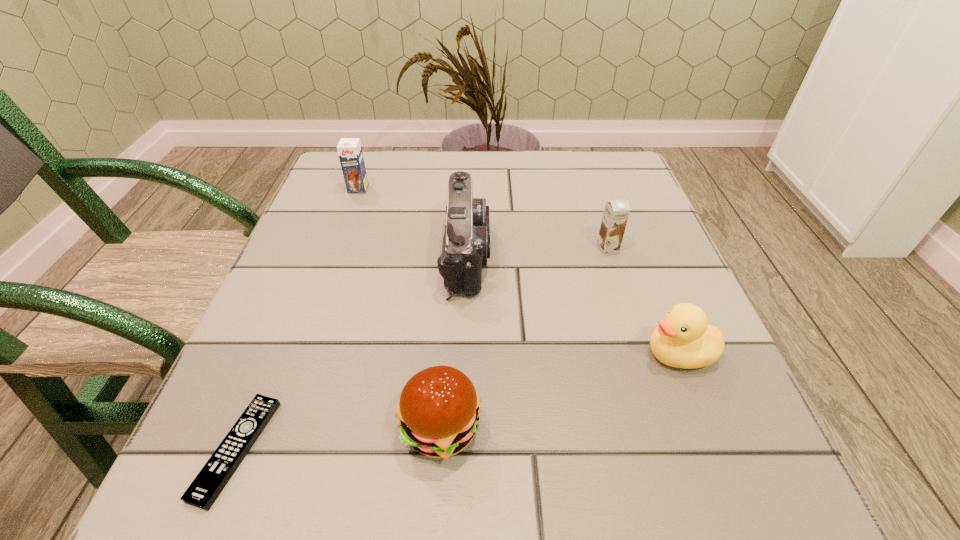
This screenshot has height=540, width=960. What are the coordinates of `the third closest object to the hamburger` in the screenshot? It's located at (683, 339).

Find the location of a particular element. object that ranks as the closest to the camcorder is located at coordinates (439, 410).

You are a GUI agent. You are given a task and a screenshot of the screen. Output one action in this format:
    pyautogui.click(x=<x>, y=<y>)
    Task: Click on the vacant space that satisfies the following two spatial constraints: 1. on the front label of the farther chocolate milk; 2. on the left side of the right chocolate milk
    
    Given the screenshot: What is the action you would take?
    pyautogui.click(x=337, y=247)

You are a GUI agent. You are given a task and a screenshot of the screen. Output one action in this format:
    pyautogui.click(x=<x>, y=<y>)
    Task: Click on the vacant region that satisfies the following two spatial constraints: 1. on the front label of the left chocolate milk; 2. on the right side of the right chocolate milk
    This screenshot has width=960, height=540.
    Given the screenshot: What is the action you would take?
    pyautogui.click(x=337, y=247)